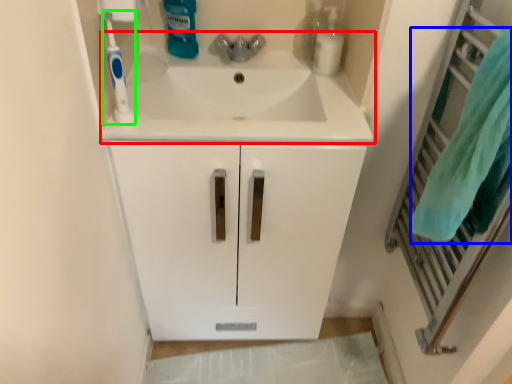
Question: Which object is positioned farthest from sink (highlighted by a red box)? Select from bath towel (highlighted by a blue box) and toothbrush (highlighted by a green box).

Choices:
 (A) bath towel
 (B) toothbrush

Answer: (A)